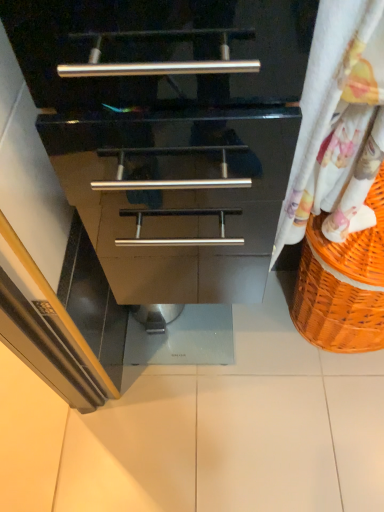
I want to click on vacant space situated above white glossy tile at center (from a real-world perspective), so click(177, 318).